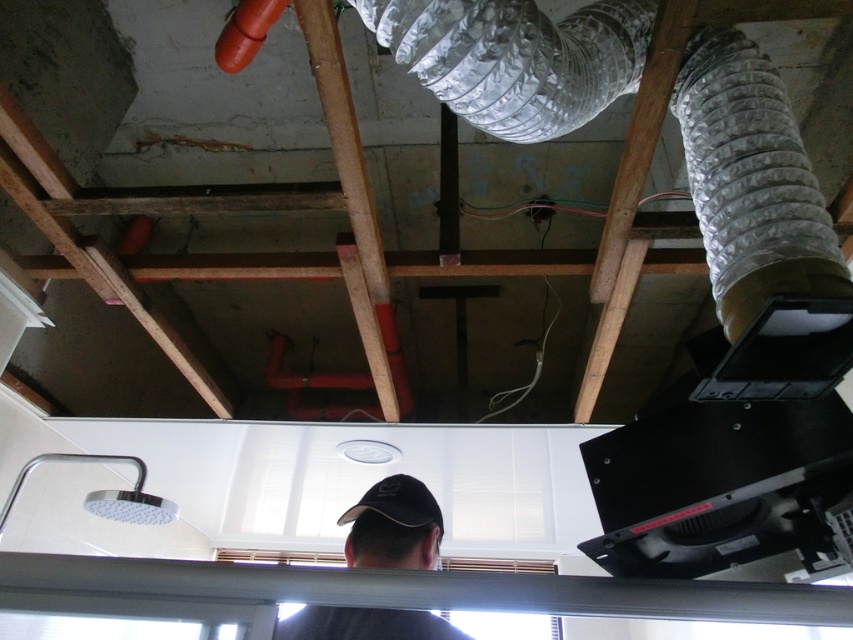
You are a construction worker standing in the unfinished building and see the white plastic beam at lower center and the black fabric baseball cap at center. Which object is nearer to you?

The white plastic beam at lower center is closer to the viewer than the black fabric baseball cap at center.

You are a construction worker standing at the base of the unfinished building area shown. You need to access the brown wooden beam at center for inspection. Is the white plastic beam at lower center blocking your direct path to it?

The white plastic beam at lower center is located below the brown wooden beam at center, so it is not blocking the direct path to the brown wooden beam at center. You can access the brown wooden beam at center without needing to move the white plastic beam at lower center.

You are standing at the bottom of this unfinished building area and notice a point marked at coordinates [355,211]. What object is located at this point?

The point at coordinates [355,211] corresponds to the brown wooden beam at center.